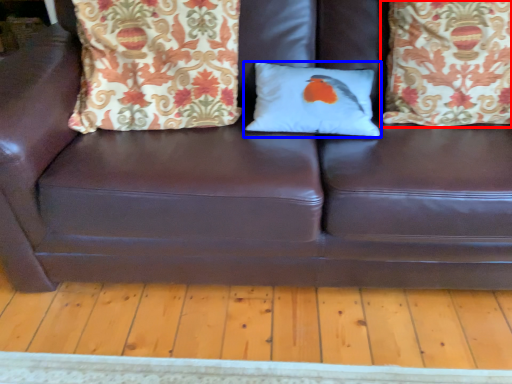
Question: Which object appears farthest to the camera in this image, pillow (highlighted by a red box) or pillow (highlighted by a blue box)?

Choices:
 (A) pillow
 (B) pillow

Answer: (B)